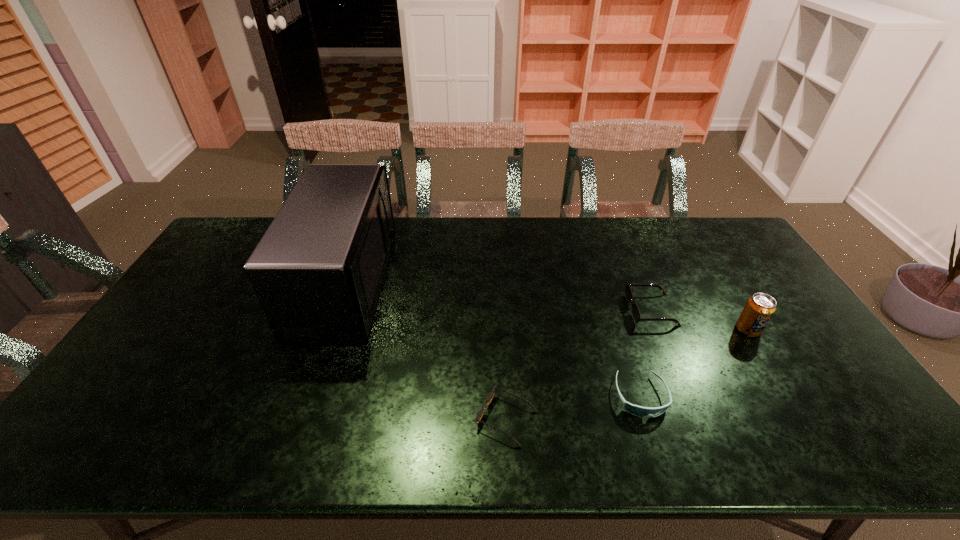
Locate an element on the screen. unoccupied position between the shorter sunglasses and the rightmost object is located at coordinates (627, 374).

Where is `blank region between the right sunglasses and the shorter sunglasses`? Image resolution: width=960 pixels, height=540 pixels. blank region between the right sunglasses and the shorter sunglasses is located at coordinates (579, 364).

I want to click on vacant space in between the nearer sunglasses and the taller sunglasses, so click(579, 364).

In order to click on vacant area that lies between the taller sunglasses and the soda can in this screenshot , I will do pyautogui.click(x=700, y=320).

This screenshot has height=540, width=960. In order to click on vacant area that lies between the farther sunglasses and the microwave_oven in this screenshot , I will do `click(499, 297)`.

Find the location of `free spot between the leftmost object and the goggles`. free spot between the leftmost object and the goggles is located at coordinates (493, 340).

What are the coordinates of `the third closest object relative to the microwave_oven` in the screenshot? It's located at (628, 292).

The width and height of the screenshot is (960, 540). Identify the location of object that stands as the closest to the shorter sunglasses. (636, 410).

The width and height of the screenshot is (960, 540). In order to click on vacant space that satisfies the following two spatial constraints: 1. on the front-facing side of the right sunglasses; 2. on the front-facing side of the goggles in this screenshot , I will do click(686, 396).

Where is `vacant space that satisfies the following two spatial constraints: 1. on the front-facing side of the farther sunglasses; 2. on the front-facing side of the goggles`? This screenshot has width=960, height=540. vacant space that satisfies the following two spatial constraints: 1. on the front-facing side of the farther sunglasses; 2. on the front-facing side of the goggles is located at coordinates (686, 396).